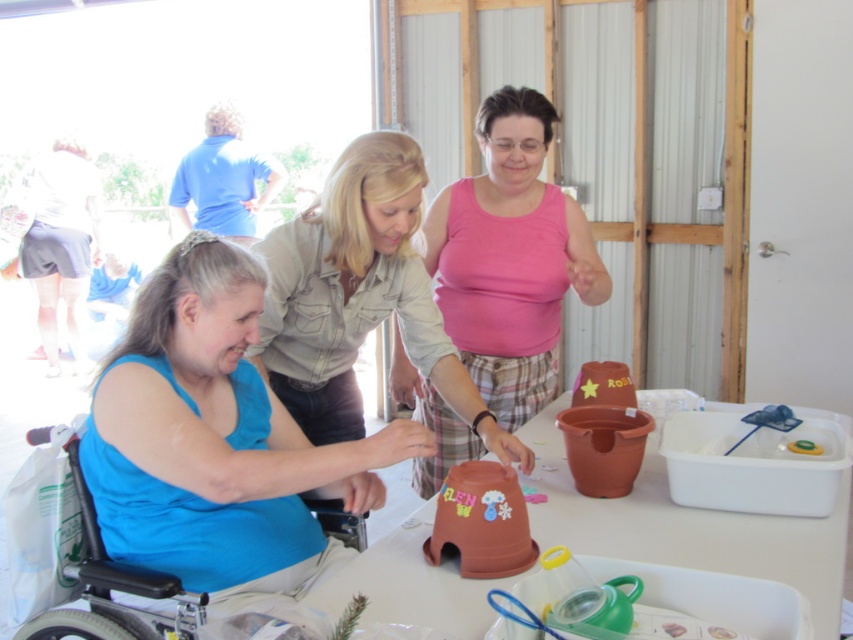
From the picture: You are standing at the entrance of the room and want to locate the matte brown pot at center. Which direction should you move to reach it?

The matte brown pot at center is located at point (358, 298), so you should move towards the center of the room to reach it.

You are organizing a display and need to place the matte brown pot at center and the terracotta clay pot at center on a shelf. Which pot should you place at the back to avoid blocking the view of the shorter one?

The matte brown pot at center is much taller than the terracotta clay pot at center, so you should place the matte brown pot at center at the back to avoid blocking the view of the shorter one.